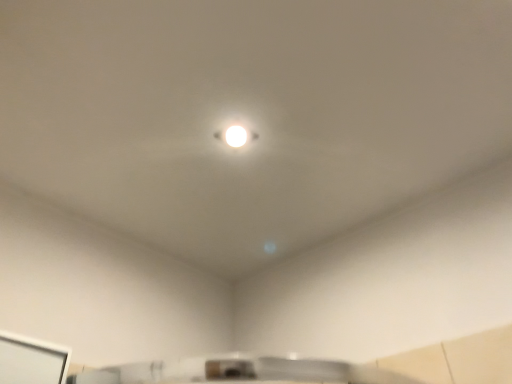
In order to face white glossy light at center, should I rotate leftwards or rightwards?

Turn left by 2.795 degrees to look at white glossy light at center.

What do you see at coordinates (236, 136) in the screenshot? The image size is (512, 384). I see `white glossy light at center` at bounding box center [236, 136].

Measure the distance between point (233, 133) and camera.

The distance of point (233, 133) from camera is 3.81 feet.

Locate an element on the screen. Image resolution: width=512 pixels, height=384 pixels. white glossy light at center is located at coordinates (236, 136).

I want to click on white glossy light at center, so click(x=236, y=136).